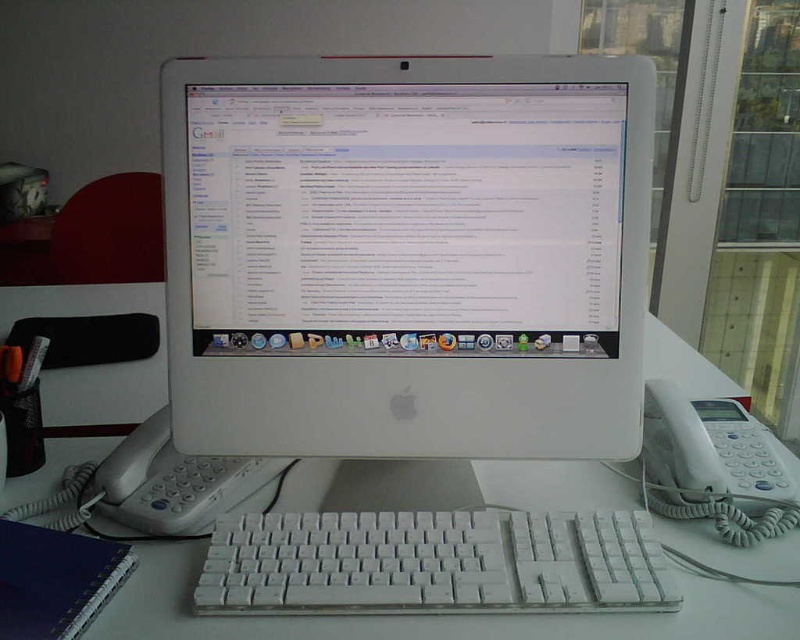
You are a delivery person who needs to place a small package on the desk. The package must be placed at a point that is exactly 27.87 inches away from the camera. Can you determine if the point at coordinates point (536, 134) is suitable for placing the package?

The point at coordinates point (536, 134) is exactly 27.87 inches away from the camera, so yes, it is suitable for placing the package.

You are setting up a new desk and want to place a decorative item between the white glossy monitor at center and the white plastic keyboard at center. Considering their sizes, which object should the decorative item be placed closer to?

The decorative item should be placed closer to the white plastic keyboard at center because the white glossy monitor at center is much taller and thus occupies more vertical space, making the keyboard a better candidate for a closer placement of the decorative item.

You are sitting at a desk and want to reach for a pen that is on the white glossy monitor at center. If your arm can extend 70 centimeters, can you comfortably reach the pen?

The white glossy monitor at center is 69.19 centimeters away from the viewer. Since your arm can extend 70 centimeters, you can comfortably reach the pen on the white glossy monitor at center.